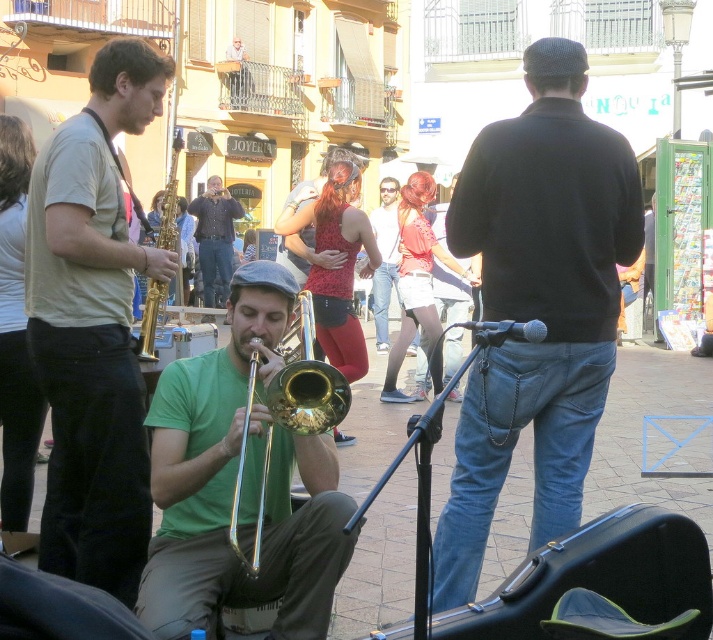
Which is more to the right, denim jacket at center or gold brass trumpet at left?

gold brass trumpet at left

Is denim jacket at center smaller than gold brass trumpet at left?

Indeed, denim jacket at center has a smaller size compared to gold brass trumpet at left.

Is point (205, 234) positioned before point (140, 317)?

No.

The image size is (713, 640). What are the coordinates of `denim jacket at center` in the screenshot? It's located at (215, 237).

Does point (93, 317) lie in front of point (195, 202)?

Yes, it is in front of point (195, 202).

Who is lower down, matte gold saxophone at left or denim jacket at center?

Positioned lower is matte gold saxophone at left.

Measure the distance between matte gold saxophone at left and camera.

A distance of 16.65 feet exists between matte gold saxophone at left and camera.

Locate an element on the screen. matte gold saxophone at left is located at coordinates (93, 326).

Between black matte sweater at center and gold shiny trumpet at center, which one has more height?

With more height is black matte sweater at center.

Who is more distant from viewer, [545,177] or [309,332]?

The point [309,332] is behind.

I want to click on black matte sweater at center, so click(x=538, y=305).

Where is `black matte sweater at center`? black matte sweater at center is located at coordinates (538, 305).